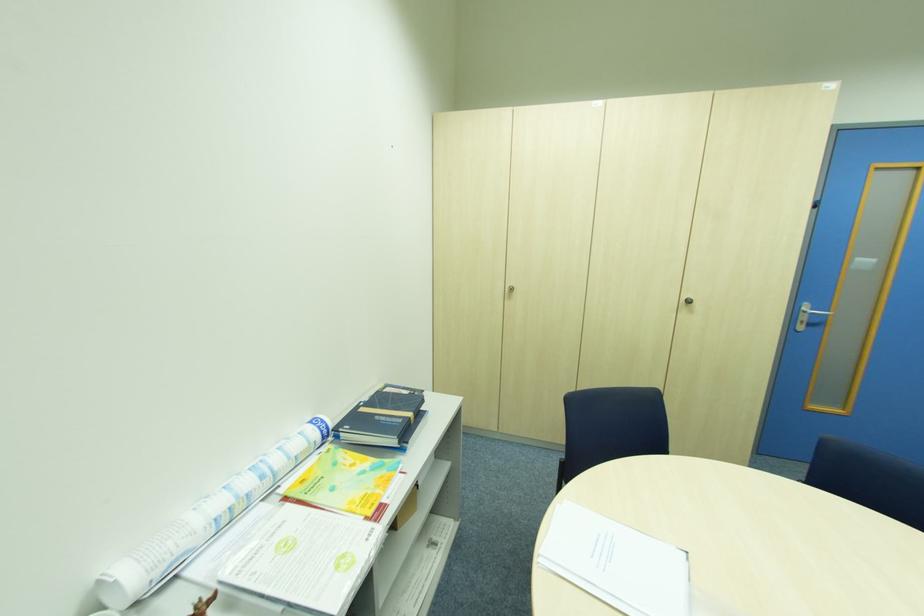
The height and width of the screenshot is (616, 924). Describe the element at coordinates (808, 315) in the screenshot. I see `a silver door handle` at that location.